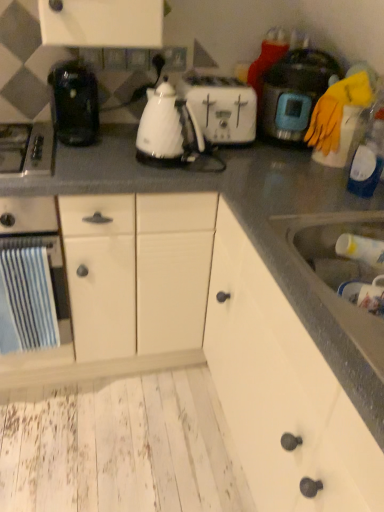
Question: Considering the positions of white glossy electric kettle at center, which ranks as the second kitchen appliance in left-to-right order, and white matte cabinet at center, arranged as the second cabinetry when viewed from the front, in the image, is white glossy electric kettle at center, which ranks as the second kitchen appliance in left-to-right order, taller or shorter than white matte cabinet at center, arranged as the second cabinetry when viewed from the front,?

Choices:
 (A) short
 (B) tall

Answer: (A)

Question: In terms of width, does white glossy electric kettle at center, which ranks as the second kitchen appliance in left-to-right order, look wider or thinner when compared to white matte cabinet at center, arranged as the second cabinetry when viewed from the front?

Choices:
 (A) thin
 (B) wide

Answer: (A)

Question: Estimate the real-world distances between objects in this image. Which object is closer to the blue striped towel at left, marked as the third kitchen appliance in a right-to-left arrangement?

Choices:
 (A) white plastic toaster at center
 (B) white matte cabinet at lower right, arranged as the 2th cabinetry when viewed from the back
 (C) white matte cabinet at center, acting as the first cabinetry starting from the back
 (D) transparent plastic bottle at right, which appears as the second bottle when ordered from the bottom
 (E) white plastic bottle at sink, the 1th bottle when ordered from bottom to top

Answer: (C)

Question: Which object is the farthest from the white matte cabinet at center, arranged as the second cabinetry when viewed from the front?

Choices:
 (A) blue striped towel at left, marked as the third kitchen appliance in a right-to-left arrangement
 (B) transparent plastic bottle at right, which appears as the second bottle when ordered from the bottom
 (C) satin silver gas stove at left
 (D) white matte cabinet at lower right, the first cabinetry positioned from the front
 (E) white glossy electric kettle at center, positioned as the second kitchen appliance in right-to-left order

Answer: (B)